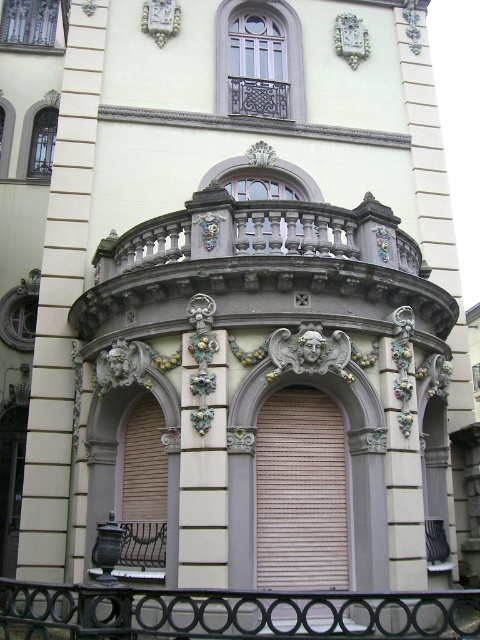
Question: Can you confirm if black wrought iron railing at lower center is bigger than white glossy pillar at center?

Choices:
 (A) yes
 (B) no

Answer: (A)

Question: In this image, where is carved stone balcony at center located relative to black wrought iron railing at lower center?

Choices:
 (A) left
 (B) right

Answer: (B)

Question: Which point appears farthest from the camera in this image?

Choices:
 (A) (48, 416)
 (B) (208, 308)
 (C) (282, 273)
 (D) (272, 621)

Answer: (A)

Question: Which of the following is the closest to the observer?

Choices:
 (A) pos(48,449)
 (B) pos(191,616)
 (C) pos(191,538)
 (D) pos(349,244)

Answer: (B)

Question: Can you confirm if carved stone balcony at center is positioned to the left of black wrought iron railing at lower center?

Choices:
 (A) yes
 (B) no

Answer: (B)

Question: Which point is farther to the camera?

Choices:
 (A) (192, 525)
 (B) (143, 337)

Answer: (B)